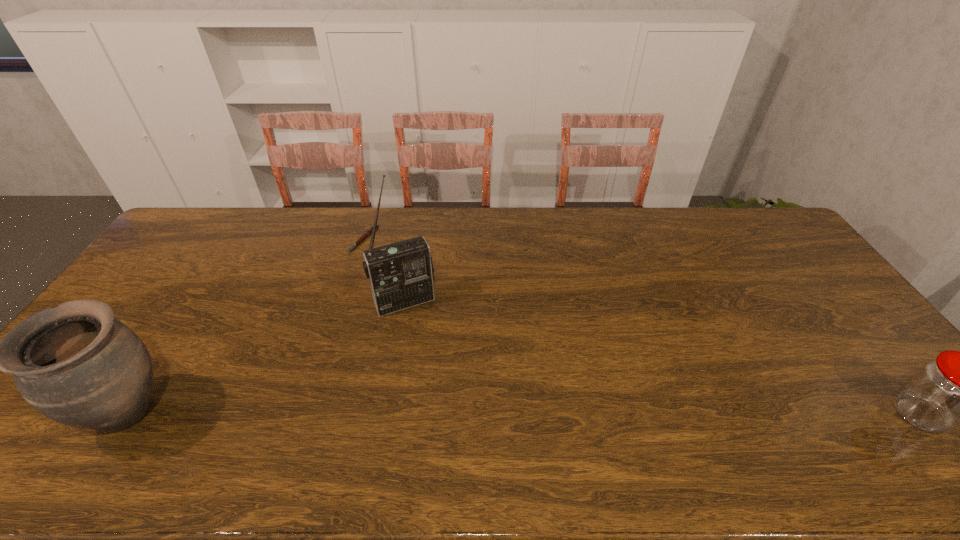
You are a GUI agent. You are given a task and a screenshot of the screen. Output one action in this format:
    pyautogui.click(x=<x>, y=<y>)
    Task: Click on the vacant space located on the display of the radio receiver
    
    Given the screenshot: What is the action you would take?
    (455, 403)

The height and width of the screenshot is (540, 960). I want to click on vacant area located on the display of the radio receiver, so click(x=449, y=390).

Where is `vacant space located 0.220m on the display of the radio receiver`? The height and width of the screenshot is (540, 960). vacant space located 0.220m on the display of the radio receiver is located at coordinates (442, 372).

This screenshot has width=960, height=540. I want to click on object at the far edge, so click(368, 232).

Where is `object at the near edge`? object at the near edge is located at coordinates (76, 364).

Image resolution: width=960 pixels, height=540 pixels. I want to click on object present at the left edge, so click(76, 364).

The image size is (960, 540). I want to click on object that is at the near left corner, so click(x=76, y=364).

The image size is (960, 540). Find the location of `blank space at the far edge of the desktop`. blank space at the far edge of the desktop is located at coordinates (353, 206).

In the image, there is a desktop. Find the location of `free space at the near edge`. free space at the near edge is located at coordinates (235, 396).

You are a GUI agent. You are given a task and a screenshot of the screen. Output one action in this format:
    pyautogui.click(x=<x>, y=<y>)
    Task: Click on the free space at the left edge of the desktop
    
    Given the screenshot: What is the action you would take?
    pyautogui.click(x=126, y=310)